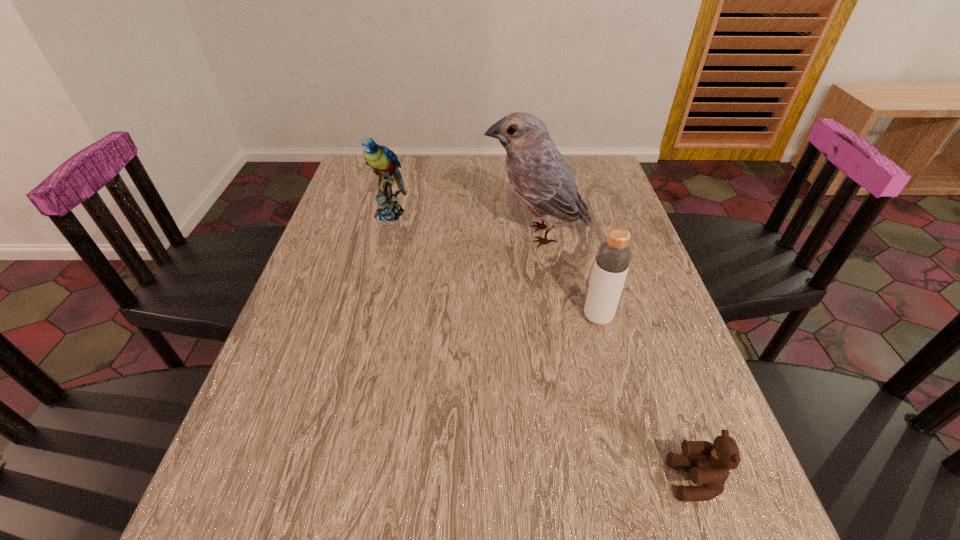
What are the coordinates of `the right parrot` in the screenshot? It's located at (539, 175).

Identify the location of the tallest object. The width and height of the screenshot is (960, 540). click(x=539, y=175).

Locate an element on the screen. The height and width of the screenshot is (540, 960). the left parrot is located at coordinates (383, 161).

Image resolution: width=960 pixels, height=540 pixels. What are the coordinates of `the shorter parrot` in the screenshot? It's located at (383, 161).

In order to click on bottle in this screenshot , I will do `click(613, 257)`.

The width and height of the screenshot is (960, 540). Identify the location of the nearest object. (711, 463).

Locate an element on the screen. The image size is (960, 540). teddy bear is located at coordinates (711, 463).

I want to click on free spot located 0.190m on the front-facing side of the right parrot, so click(414, 235).

What are the coordinates of `free space located on the front-facing side of the right parrot` in the screenshot? It's located at (359, 235).

The width and height of the screenshot is (960, 540). I want to click on vacant space located on the front-facing side of the right parrot, so click(x=440, y=235).